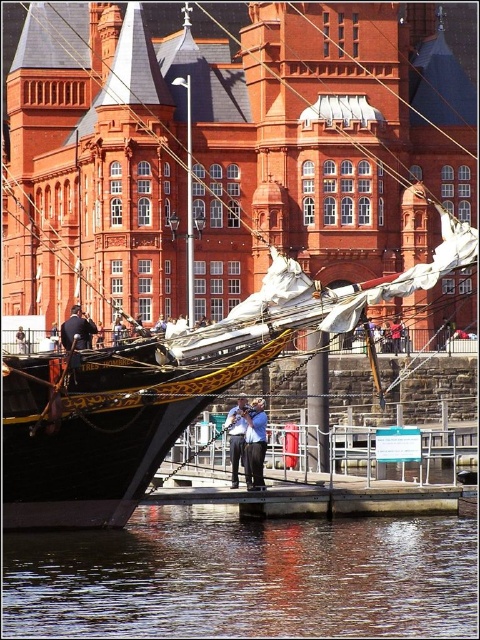
You are standing on the pier near the Tres Hombres ship and want to walk towards the ship. There are two points marked on the pier at coordinates point (287, 586) and point (228, 417). Which point should you walk towards to get closer to the ship?

You should walk towards point (287, 586) because it is in front of point (228, 417), meaning it is closer to the ship.

What are the coordinates of the blue fabric shirt at center?

The blue fabric shirt at center is located at coordinates point (x=254, y=444).

You are standing at the point marked as point (x=264, y=440) on the waterfront pier. You want to take a photo of the historic ship Tres Hombres. If the camera you are using has a focal length of 50mm and you are 246.02 feet away from the camera, what is the approximate angle of view needed to capture the entire ship in your photo? Assume the ship is 150 feet long and the camera sensor has a diagonal measurement of 24mm.

To determine the angle of view needed, first convert the distance from feet to millimeters for consistency. 246.02 feet is approximately 74,989 mm. The ship is 150 feet long, which is about 45,720 mm. Using the formula for angle of view, angle of view in radians is 2 times the arctangent of half the ship length divided by the distance. Calculating this gives 2 arctan 45,720 mm divided by 2 times 74,989 mm. This results in an angle of approximately 1.9 degrees. The camera sensor diagonal of 24mm corresponds,